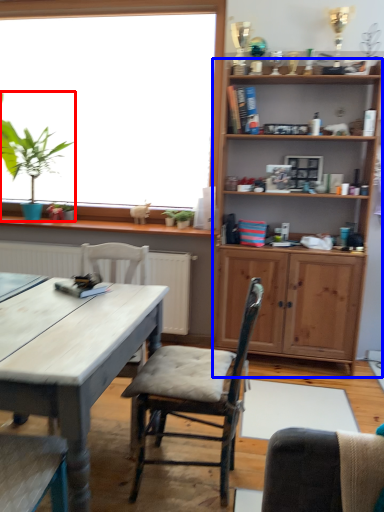
Question: Which object is further to the camera taking this photo, houseplant (highlighted by a red box) or shelf (highlighted by a blue box)?

Choices:
 (A) houseplant
 (B) shelf

Answer: (A)